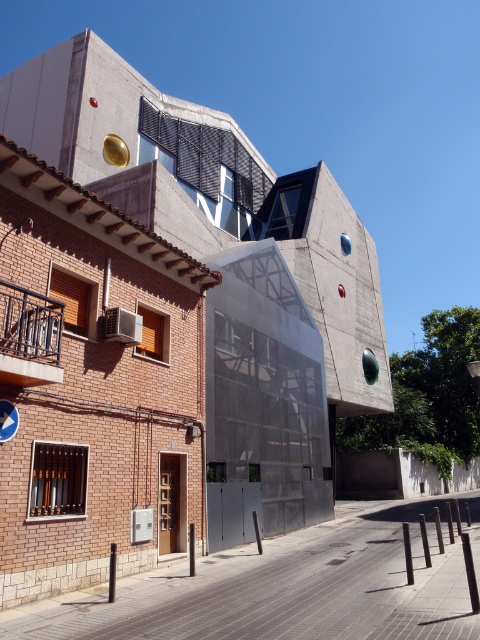
You are a delivery person trying to navigate through the street. You need to deliver a package to the blue plastic sign at center. However, there is a concrete building at center blocking your path. Can you go around the building to reach the sign?

The concrete building at center is in front of blue plastic sign at center, so you can go around the building to reach the sign as it is blocking the direct path.

You are a city planner assessing the street layout. You need to install a new bench that must be placed between the concrete building at center and the blue plastic sign at center. Given their widths, which object will require more space on the street for the bench placement?

The concrete building at center has a greater width than the blue plastic sign at center, so placing the bench between them would require more space to accommodate the concrete building at center.